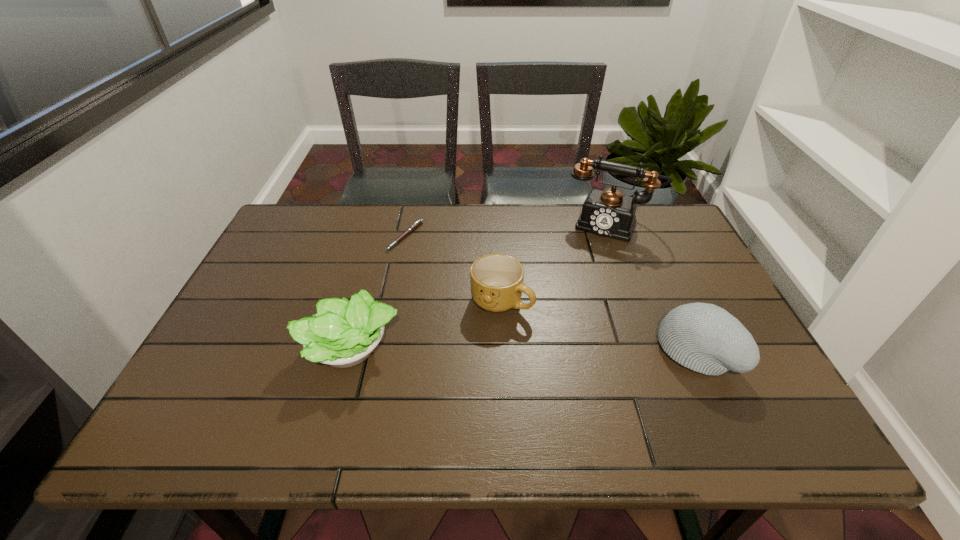
Where is `free space on the desktop that is between the lettuce and the second tallest object and is positioned on the front of the tallest object at the rotary dial`? This screenshot has height=540, width=960. free space on the desktop that is between the lettuce and the second tallest object and is positioned on the front of the tallest object at the rotary dial is located at coordinates (563, 350).

Where is `vacant space on the desktop that is between the lettuce and the beanie and is positioned at the nib of the pen`? The height and width of the screenshot is (540, 960). vacant space on the desktop that is between the lettuce and the beanie and is positioned at the nib of the pen is located at coordinates (477, 349).

This screenshot has height=540, width=960. What are the coordinates of `vacant space on the desktop that is between the lettuce and the fourth shortest object and is positioned on the side with the handle of the mug` in the screenshot? It's located at (565, 350).